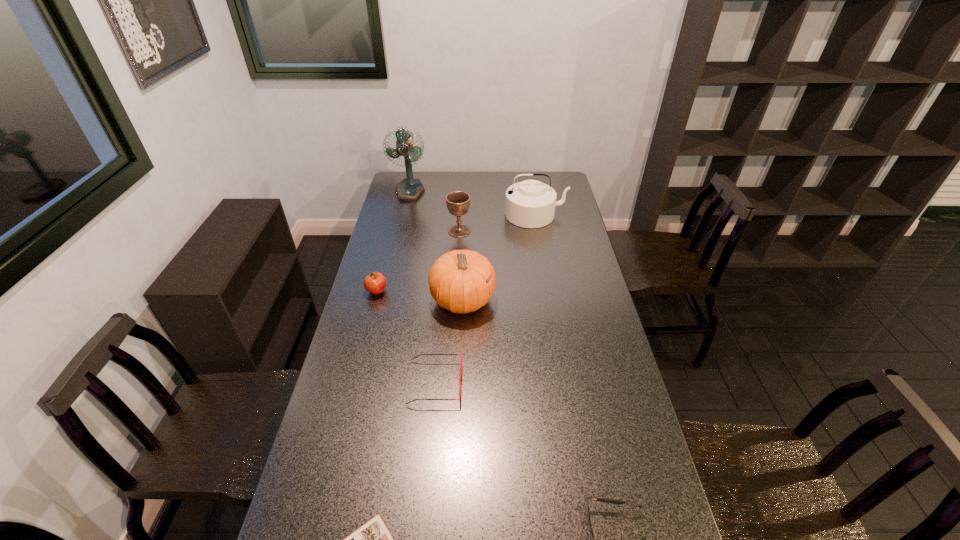
Image resolution: width=960 pixels, height=540 pixels. Find the location of `free spot at the left edge of the desktop`. free spot at the left edge of the desktop is located at coordinates (307, 474).

Where is `vacant space at the right edge of the desktop`? The width and height of the screenshot is (960, 540). vacant space at the right edge of the desktop is located at coordinates (607, 322).

The height and width of the screenshot is (540, 960). In order to click on free spot between the fourth shortest object and the pumpkin in this screenshot , I will do `click(420, 296)`.

In order to click on blank region between the pumpkin and the fourth shortest object in this screenshot , I will do `click(420, 296)`.

This screenshot has height=540, width=960. Find the location of `object that is the fifth closest to the seventh tallest object`. object that is the fifth closest to the seventh tallest object is located at coordinates (458, 202).

Image resolution: width=960 pixels, height=540 pixels. What are the coordinates of `object that ranks as the third closest to the pumpkin` in the screenshot? It's located at (458, 202).